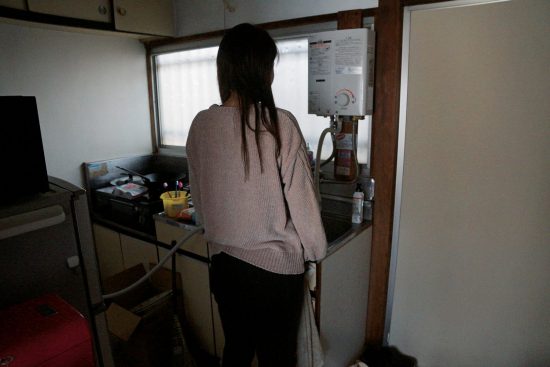
The image size is (550, 367). Find the location of `hose running to sink`. hose running to sink is located at coordinates (181, 239).